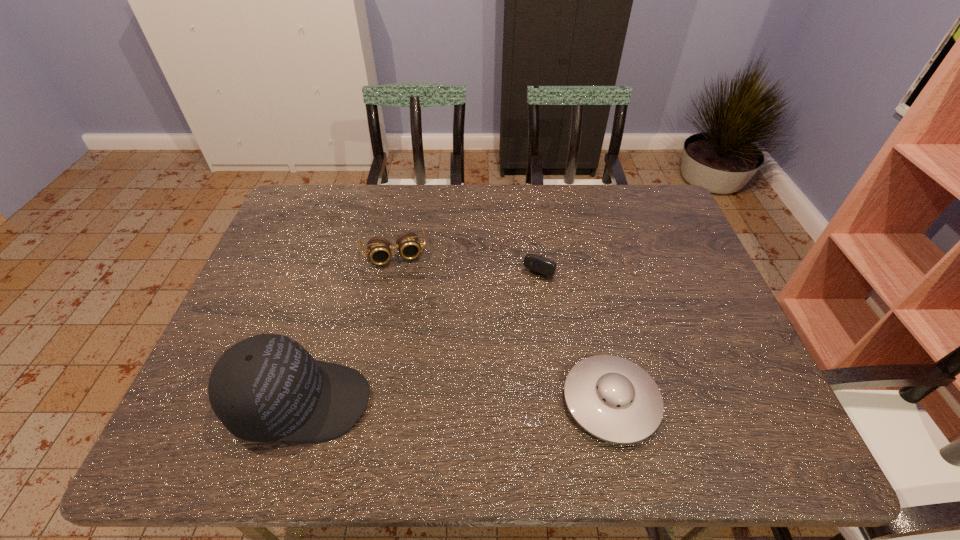
The width and height of the screenshot is (960, 540). Find the location of `vacant space at the far left corner of the desktop`. vacant space at the far left corner of the desktop is located at coordinates (340, 186).

Locate an element on the screen. This screenshot has width=960, height=540. vacant space at the far right corner is located at coordinates (656, 187).

Where is `free space at the near right corner of the desktop`? The image size is (960, 540). free space at the near right corner of the desktop is located at coordinates (759, 386).

Identify the location of vacant space that's between the saucer and the goggles. The image size is (960, 540). (502, 328).

The width and height of the screenshot is (960, 540). Find the location of `vacant space in between the goggles and the saucer`. vacant space in between the goggles and the saucer is located at coordinates (502, 328).

Image resolution: width=960 pixels, height=540 pixels. Find the location of `free space between the webcam and the saucer`. free space between the webcam and the saucer is located at coordinates (581, 326).

I want to click on unoccupied area between the baseball cap and the saucer, so click(x=456, y=402).

This screenshot has width=960, height=540. Find the location of `vacant space that's between the saucer and the goggles`. vacant space that's between the saucer and the goggles is located at coordinates (502, 328).

Where is `free space between the baseball cap and the saucer`? free space between the baseball cap and the saucer is located at coordinates (456, 402).

The width and height of the screenshot is (960, 540). What are the coordinates of `free space between the saucer and the webcam` in the screenshot? It's located at (581, 326).